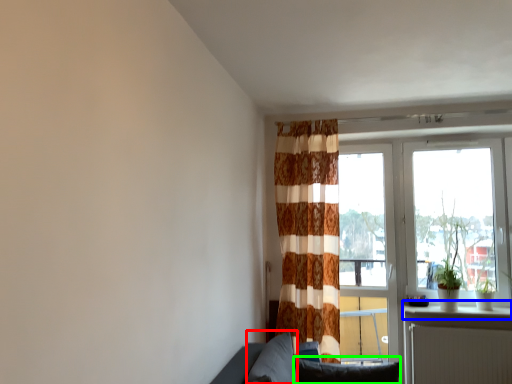
Question: Which object is the closest to the pillow (highlighted by a red box)? Choose among these: window sill (highlighted by a blue box) or pillow (highlighted by a green box).

Choices:
 (A) window sill
 (B) pillow

Answer: (B)